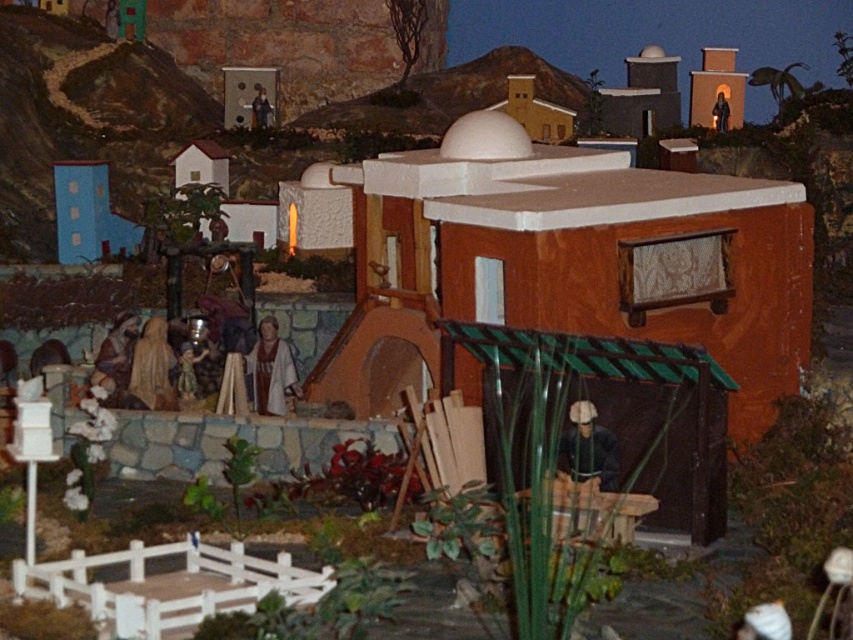
From the picture: Between dark brown wooden figure at center and smooth brown statue at upper center, which one is positioned lower?

dark brown wooden figure at center

Is dark brown wooden figure at center above smooth brown statue at upper center?

No, dark brown wooden figure at center is not above smooth brown statue at upper center.

Is point (587, 467) behind point (254, 115)?

No, it is not.

This screenshot has height=640, width=853. Identify the location of dark brown wooden figure at center. (589, 448).

Is dark brown wooden figure at center above smooth brown statue at lower left?

No.

Which is in front, point (589, 449) or point (107, 396)?

Positioned in front is point (589, 449).

I want to click on dark brown wooden figure at center, so click(x=589, y=448).

Is smooth white statue at center below matte black statue at upper right?

Correct, smooth white statue at center is located below matte black statue at upper right.

How much distance is there between smooth white statue at center and matte black statue at upper right?

smooth white statue at center and matte black statue at upper right are 6.41 meters apart from each other.

Who is more distant from viewer, (256,404) or (724,115)?

The point (724,115) is behind.

Where is `smooth white statue at center`? smooth white statue at center is located at coordinates (271, 371).